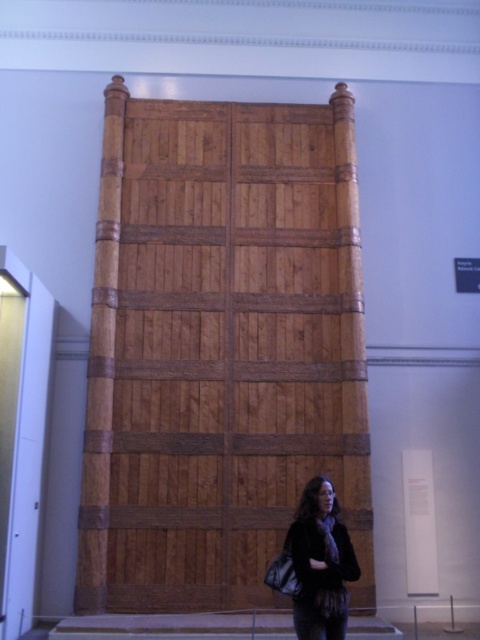
Can you confirm if natural wood door at center is shorter than dark brown leather jacket at lower center?

In fact, natural wood door at center may be taller than dark brown leather jacket at lower center.

Does natural wood door at center have a lesser width compared to dark brown leather jacket at lower center?

Incorrect, natural wood door at center's width is not less than dark brown leather jacket at lower center's.

Between point (178, 240) and point (299, 524), which one is positioned in front?

Point (299, 524) is in front.

Image resolution: width=480 pixels, height=640 pixels. I want to click on natural wood door at center, so click(219, 348).